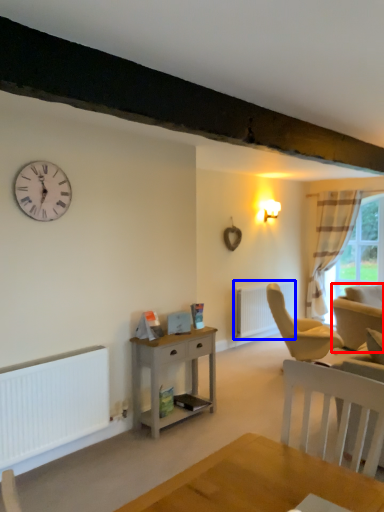
Question: Which object appears closest to the camera in this image, swivel chair (highlighted by a red box) or radiator (highlighted by a blue box)?

Choices:
 (A) swivel chair
 (B) radiator

Answer: (A)